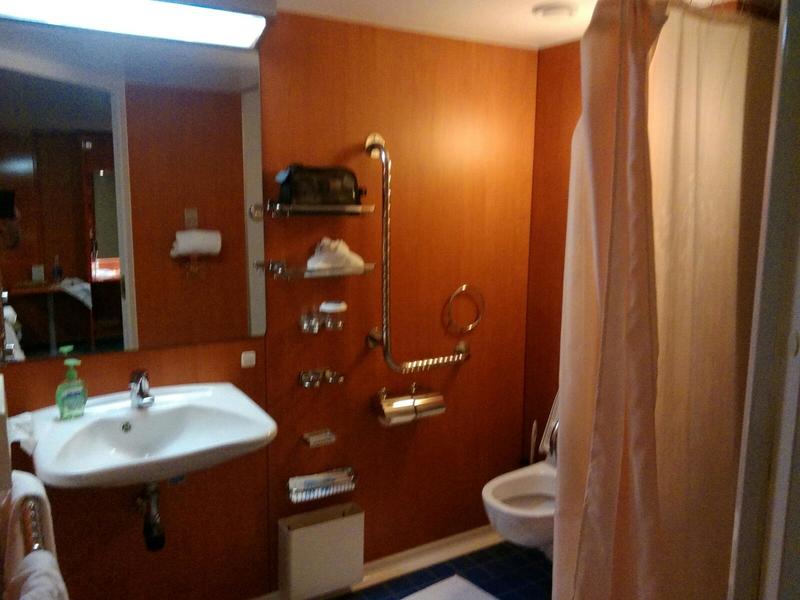
Locate an element on the screen. The height and width of the screenshot is (600, 800). white bath towel is located at coordinates (22, 477).